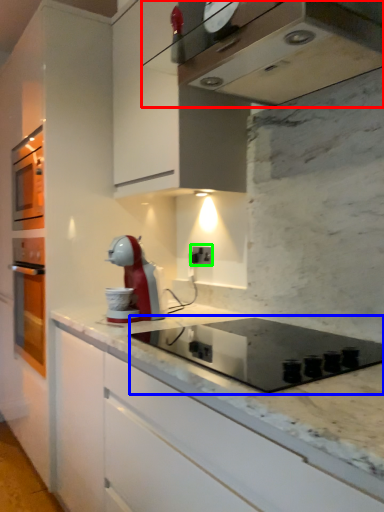
Question: Which object is positioned farthest from home appliance (highlighted by a red box)? Select from appliance (highlighted by a blue box) and electric outlet (highlighted by a green box).

Choices:
 (A) appliance
 (B) electric outlet

Answer: (B)